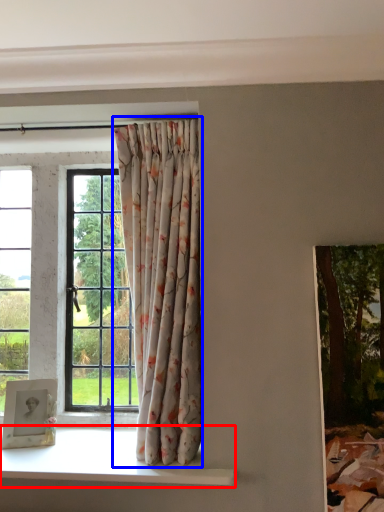
Question: Among these objects, which one is nearest to the camera, window sill (highlighted by a red box) or curtain (highlighted by a blue box)?

Choices:
 (A) window sill
 (B) curtain

Answer: (A)